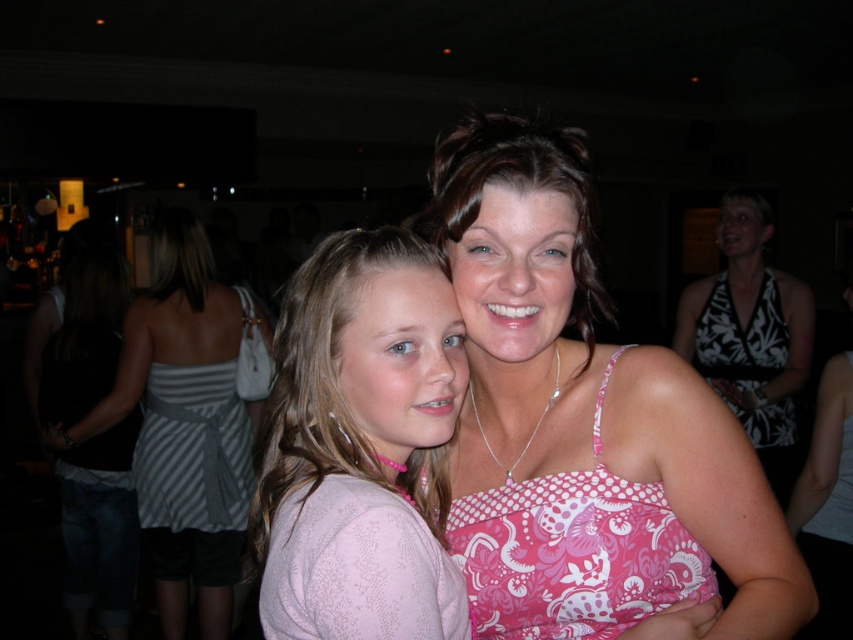
You are a fashion designer observing the image and need to determine which clothing item has a wider silhouette between the pink dotted tank top at center and the white floral print dress at right. Based on the description, which one would you recommend for a client seeking a more voluminous look?

The pink dotted tank top at center has a larger width than the white floral print dress at right, so it would be the better recommendation for a client seeking a more voluminous look.

You are a photographer at a party and you see two outfits in the image. The outfits are the pink dotted tank top at center and the white floral print dress at right. Which outfit is more to the left?

The pink dotted tank top at center is more to the left than the white floral print dress at right.

You are a photographer who wants to ensure both the pink patterned tank top at center and the pink fabric dress at center are clearly visible in the photo. Which clothing item should you focus on first to ensure the other is also in focus?

The pink patterned tank top at center is located above the pink fabric dress at center. Since the tank top is higher up, focusing on it first would naturally include the dress in the frame, ensuring both are in focus.